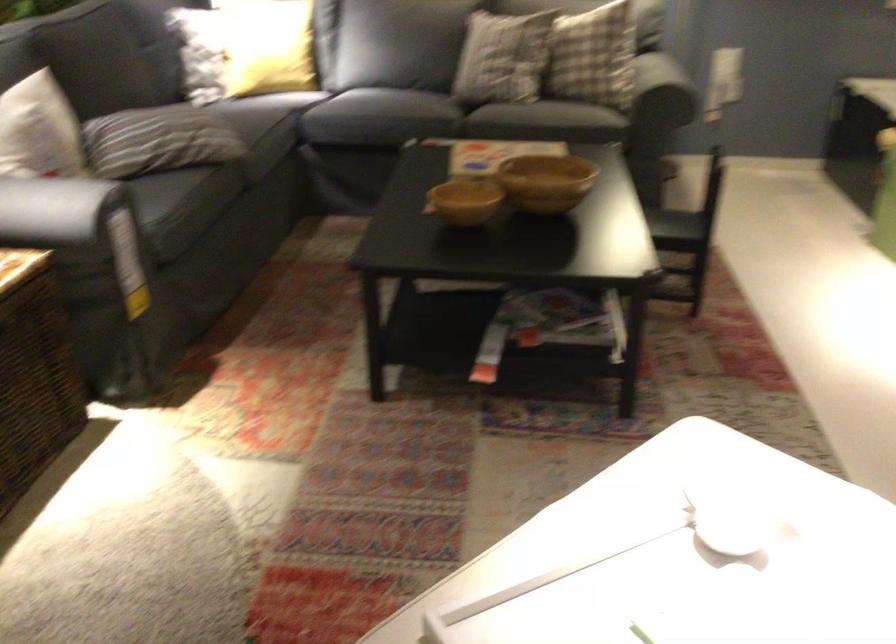
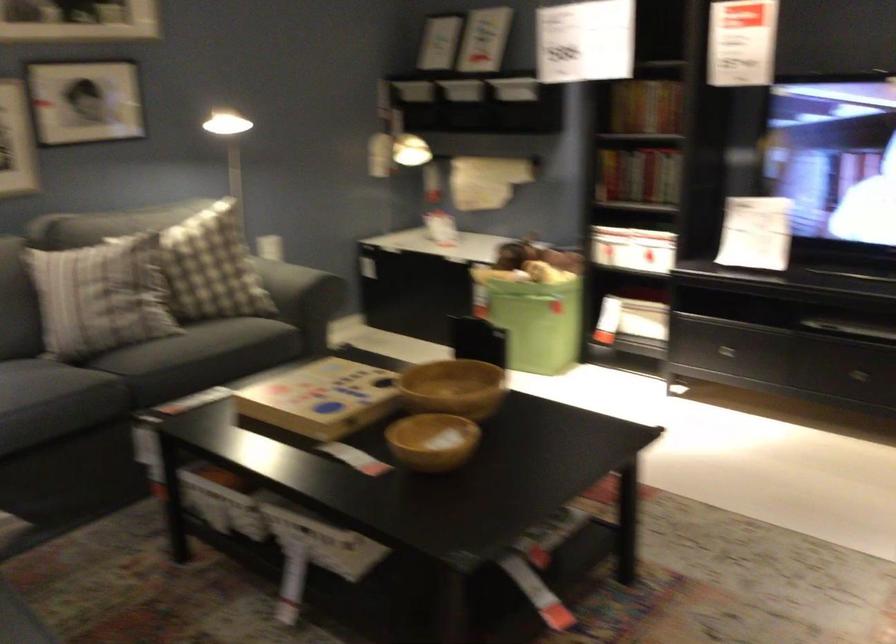
In the second image, find the point that corresponds to the point at 498,111 in the first image.

(199, 357)